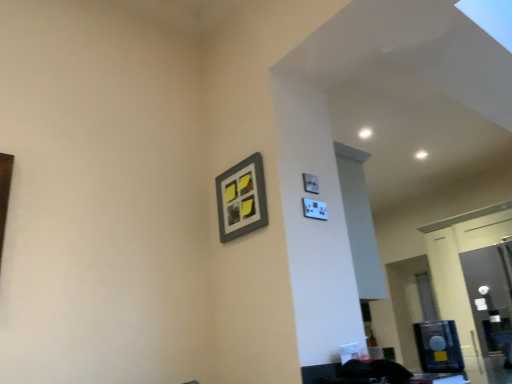
Question: From their relative heights in the image, would you say matte gray picture frame at upper right is taller or shorter than transparent glass door at right?

Choices:
 (A) short
 (B) tall

Answer: (A)

Question: From a real-world perspective, is matte gray picture frame at upper right positioned above or below transparent glass door at right?

Choices:
 (A) above
 (B) below

Answer: (A)

Question: Is point (250, 198) positioned closer to the camera than point (482, 256)?

Choices:
 (A) farther
 (B) closer

Answer: (B)

Question: Is transparent glass door at right taller or shorter than matte gray picture frame at upper right?

Choices:
 (A) tall
 (B) short

Answer: (A)

Question: Considering the positions of transparent glass door at right and matte gray picture frame at upper right in the image, is transparent glass door at right bigger or smaller than matte gray picture frame at upper right?

Choices:
 (A) small
 (B) big

Answer: (B)

Question: From a real-world perspective, is transparent glass door at right positioned above or below matte gray picture frame at upper right?

Choices:
 (A) below
 (B) above

Answer: (A)

Question: In the image, is transparent glass door at right positioned in front of or behind matte gray picture frame at upper right?

Choices:
 (A) behind
 (B) front

Answer: (A)